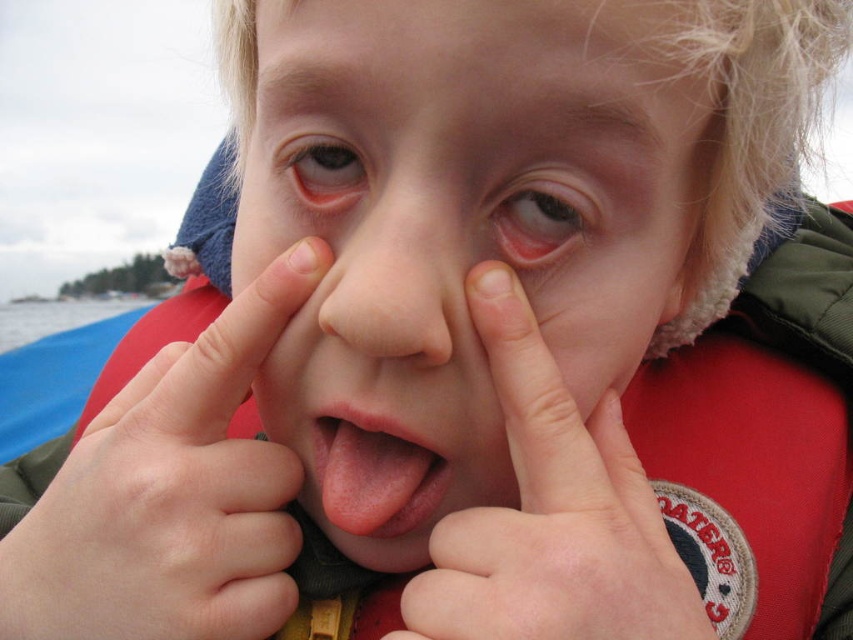
Question: Is smooth skin face at center bigger than pink smooth tongue at center?

Choices:
 (A) no
 (B) yes

Answer: (B)

Question: Which point is farther from the camera taking this photo?

Choices:
 (A) (399, 246)
 (B) (386, 355)
 (C) (167, 529)
 (D) (573, 212)

Answer: (D)

Question: Which point is closer to the camera?

Choices:
 (A) red fabric life jacket at center
 (B) pink smooth tongue at center
 (C) brown matte eye at center
 (D) smooth skin face at center

Answer: (A)

Question: Is smooth skin hand at center wider than smooth flesh-colored nose at center?

Choices:
 (A) yes
 (B) no

Answer: (A)

Question: Which point is farther from the camera taking this photo?

Choices:
 (A) (418, 1)
 (B) (345, 403)
 (C) (352, 189)
 (D) (347, 296)

Answer: (C)

Question: Does red fabric life jacket at center appear on the left side of pink smooth tongue at center?

Choices:
 (A) yes
 (B) no

Answer: (B)